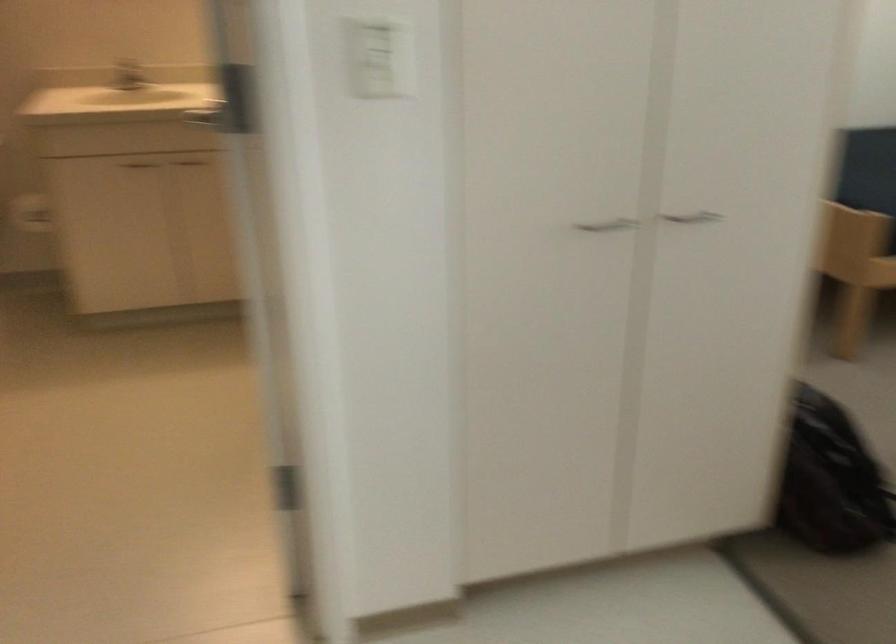
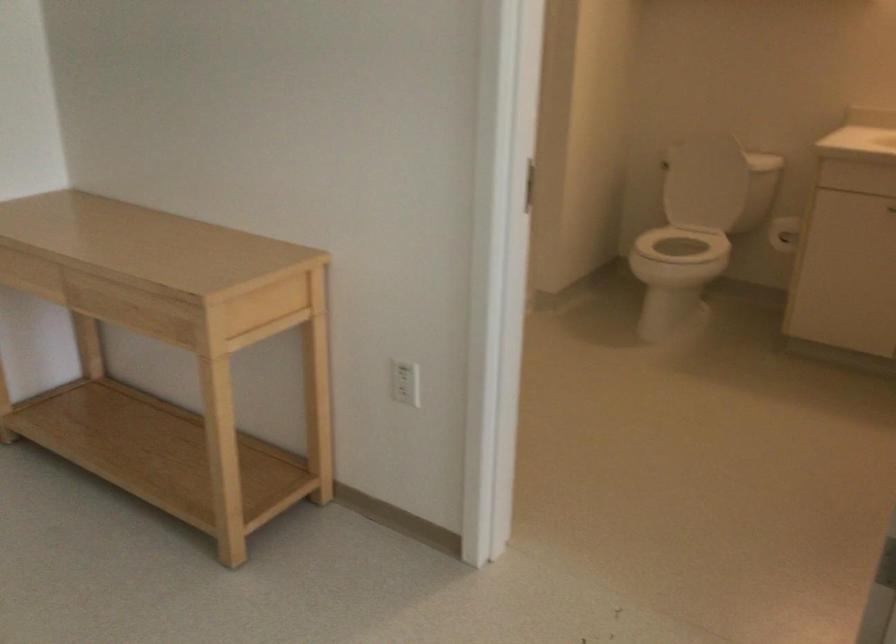
Question: The camera is either moving clockwise (left) or counter-clockwise (right) around the object. The first image is from the beginning of the video and the second image is from the end. Is the camera moving left or right when shooting the video?

Choices:
 (A) Left
 (B) Right

Answer: (B)